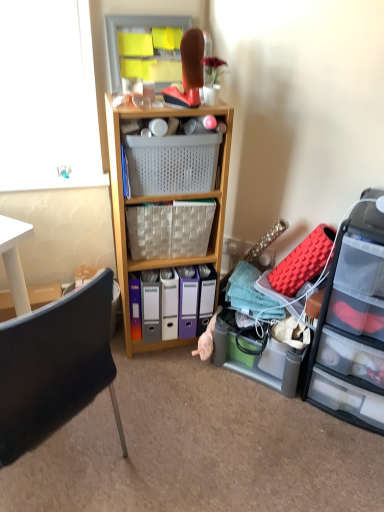
Locate an element on the screen. vacant space in front of wooden shelf at center is located at coordinates (170, 391).